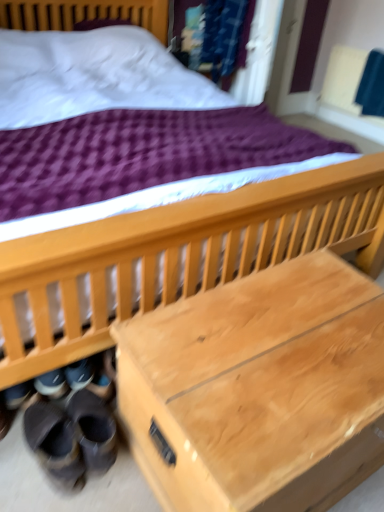
The width and height of the screenshot is (384, 512). Describe the element at coordinates (93, 429) in the screenshot. I see `black suede shoes at lower left, the first footwear from the right` at that location.

In the scene shown: Measure the distance between leather brown shoes at lower left and camera.

They are 3.74 feet apart.

Find the location of `leather-like brown shoes at lower left, which is the first footwear in left-to-right order`. leather-like brown shoes at lower left, which is the first footwear in left-to-right order is located at coordinates (55, 444).

Image resolution: width=384 pixels, height=512 pixels. I want to click on black suede shoes at lower left, the first footwear from the right, so click(x=93, y=429).

Considering the relative positions of leather brown shoes at lower left and black suede shoes at lower left, the first footwear from the right, in the image provided, is leather brown shoes at lower left to the left of black suede shoes at lower left, the first footwear from the right, from the viewer's perspective?

Yes.

Is leather brown shoes at lower left taller than black suede shoes at lower left, arranged as the 2th footwear when viewed from the left?

Indeed, leather brown shoes at lower left has a greater height compared to black suede shoes at lower left, arranged as the 2th footwear when viewed from the left.

Is leather brown shoes at lower left further to the viewer compared to black suede shoes at lower left, the first footwear from the right?

No, the depth of leather brown shoes at lower left is less than that of black suede shoes at lower left, the first footwear from the right.

Which of these two, natural wood trunk at lower center or leather brown shoes at lower left, is thinner?

Thinner between the two is leather brown shoes at lower left.

Does point (146, 382) lie in front of point (71, 444)?

Yes, point (146, 382) is closer to viewer.

From the image's perspective, is natural wood trunk at lower center located above leather brown shoes at lower left?

Correct, natural wood trunk at lower center appears higher than leather brown shoes at lower left in the image.

Considering their positions, is leather brown shoes at lower left located in front of or behind natural wood trunk at lower center?

leather brown shoes at lower left is behind natural wood trunk at lower center.

Considering the sizes of objects leather brown shoes at lower left and natural wood trunk at lower center in the image provided, who is wider, leather brown shoes at lower left or natural wood trunk at lower center?

With larger width is natural wood trunk at lower center.

From a real-world perspective, is leather brown shoes at lower left physically located above or below natural wood trunk at lower center?

Clearly, from a real-world perspective, leather brown shoes at lower left is below natural wood trunk at lower center.

From the image's perspective, which is above, leather brown shoes at lower left or natural wood trunk at lower center?

natural wood trunk at lower center, from the image's perspective.

Which object is wider, black suede shoes at lower left, the first footwear from the right, or natural wood trunk at lower center?

natural wood trunk at lower center is wider.

Between black suede shoes at lower left, the first footwear from the right, and natural wood trunk at lower center, which one has more height?

Standing taller between the two is natural wood trunk at lower center.

Is black suede shoes at lower left, the first footwear from the right, bigger or smaller than natural wood trunk at lower center?

Clearly, black suede shoes at lower left, the first footwear from the right, is smaller in size than natural wood trunk at lower center.

Can you see black suede shoes at lower left, arranged as the 2th footwear when viewed from the left, touching natural wood trunk at lower center?

No, black suede shoes at lower left, arranged as the 2th footwear when viewed from the left, is not in contact with natural wood trunk at lower center.

The width and height of the screenshot is (384, 512). What are the coordinates of `the 1st footwear positioned below the leather brown shoes at lower left (from a real-world perspective)` in the screenshot? It's located at (55, 444).

From the picture: Is leather-like brown shoes at lower left, which is the first footwear in left-to-right order, to the right of leather brown shoes at lower left from the viewer's perspective?

No, leather-like brown shoes at lower left, which is the first footwear in left-to-right order, is not to the right of leather brown shoes at lower left.

Is leather-like brown shoes at lower left, which is the first footwear in left-to-right order, located outside leather brown shoes at lower left?

No, leather-like brown shoes at lower left, which is the first footwear in left-to-right order, is not outside of leather brown shoes at lower left.

Looking at the image, does leather-like brown shoes at lower left, which ranks as the 2th footwear in right-to-left order, seem bigger or smaller compared to leather brown shoes at lower left?

Clearly, leather-like brown shoes at lower left, which ranks as the 2th footwear in right-to-left order, is smaller in size than leather brown shoes at lower left.

Could you tell me if leather-like brown shoes at lower left, which ranks as the 2th footwear in right-to-left order, is turned towards natural wood trunk at lower center?

No, leather-like brown shoes at lower left, which ranks as the 2th footwear in right-to-left order, does not turn towards natural wood trunk at lower center.

Looking at this image, from a real-world perspective, is leather-like brown shoes at lower left, which is the first footwear in left-to-right order, on natural wood trunk at lower center?

No, from a real-world perspective, leather-like brown shoes at lower left, which is the first footwear in left-to-right order, is not over natural wood trunk at lower center

Are leather-like brown shoes at lower left, which is the first footwear in left-to-right order, and natural wood trunk at lower center beside each other?

No, leather-like brown shoes at lower left, which is the first footwear in left-to-right order, is not beside natural wood trunk at lower center.

Is leather-like brown shoes at lower left, which is the first footwear in left-to-right order, not inside natural wood trunk at lower center?

Absolutely, leather-like brown shoes at lower left, which is the first footwear in left-to-right order, is external to natural wood trunk at lower center.

Which of these two, leather brown shoes at lower left or leather-like brown shoes at lower left, which is the first footwear in left-to-right order, is bigger?

With larger size is leather brown shoes at lower left.

Considering the relative positions of leather brown shoes at lower left and leather-like brown shoes at lower left, which ranks as the 2th footwear in right-to-left order, in the image provided, is leather brown shoes at lower left behind leather-like brown shoes at lower left, which ranks as the 2th footwear in right-to-left order,?

That is False.

How much distance is there between leather brown shoes at lower left and leather-like brown shoes at lower left, which ranks as the 2th footwear in right-to-left order?

leather brown shoes at lower left and leather-like brown shoes at lower left, which ranks as the 2th footwear in right-to-left order, are 1.33 inches apart.

Considering the positions of objects leather brown shoes at lower left and leather-like brown shoes at lower left, which ranks as the 2th footwear in right-to-left order, in the image provided, who is more to the left, leather brown shoes at lower left or leather-like brown shoes at lower left, which ranks as the 2th footwear in right-to-left order,?

Positioned to the left is leather-like brown shoes at lower left, which ranks as the 2th footwear in right-to-left order.

The height and width of the screenshot is (512, 384). I want to click on shoe lying in front of the black suede shoes at lower left, arranged as the 2th footwear when viewed from the left, so click(x=74, y=432).

Image resolution: width=384 pixels, height=512 pixels. Identify the location of shoe that appears below the natural wood trunk at lower center (from a real-world perspective). (74, 432).

Based on their spatial positions, is leather brown shoes at lower left or leather-like brown shoes at lower left, which ranks as the 2th footwear in right-to-left order, further from black suede shoes at lower left, the first footwear from the right?

Based on the image, leather-like brown shoes at lower left, which ranks as the 2th footwear in right-to-left order, appears to be further to black suede shoes at lower left, the first footwear from the right.

Looking at the image, which one is located closer to leather brown shoes at lower left, black suede shoes at lower left, the first footwear from the right, or natural wood trunk at lower center?

Among the two, black suede shoes at lower left, the first footwear from the right, is located nearer to leather brown shoes at lower left.

From the image, which object appears to be nearer to black suede shoes at lower left, the first footwear from the right, leather-like brown shoes at lower left, which is the first footwear in left-to-right order, or natural wood trunk at lower center?

Among the two, leather-like brown shoes at lower left, which is the first footwear in left-to-right order, is located nearer to black suede shoes at lower left, the first footwear from the right.

Based on their spatial positions, is black suede shoes at lower left, arranged as the 2th footwear when viewed from the left, or leather brown shoes at lower left closer to leather-like brown shoes at lower left, which ranks as the 2th footwear in right-to-left order?

The object closer to leather-like brown shoes at lower left, which ranks as the 2th footwear in right-to-left order, is leather brown shoes at lower left.

Based on their spatial positions, is leather brown shoes at lower left or black suede shoes at lower left, arranged as the 2th footwear when viewed from the left, closer to leather-like brown shoes at lower left, which ranks as the 2th footwear in right-to-left order?

leather brown shoes at lower left.

From the image, which object appears to be nearer to leather-like brown shoes at lower left, which ranks as the 2th footwear in right-to-left order, black suede shoes at lower left, the first footwear from the right, or natural wood trunk at lower center?

Based on the image, black suede shoes at lower left, the first footwear from the right, appears to be nearer to leather-like brown shoes at lower left, which ranks as the 2th footwear in right-to-left order.

From the image, which object appears to be farther from natural wood trunk at lower center, leather-like brown shoes at lower left, which is the first footwear in left-to-right order, or leather brown shoes at lower left?

Among the two, leather-like brown shoes at lower left, which is the first footwear in left-to-right order, is located further to natural wood trunk at lower center.

From the image, which object appears to be farther from leather brown shoes at lower left, leather-like brown shoes at lower left, which is the first footwear in left-to-right order, or black suede shoes at lower left, the first footwear from the right?

black suede shoes at lower left, the first footwear from the right, is further to leather brown shoes at lower left.

Identify the location of footwear between leather-like brown shoes at lower left, which ranks as the 2th footwear in right-to-left order, and natural wood trunk at lower center, in the horizontal direction. (93, 429).

Identify the location of shoe between leather-like brown shoes at lower left, which ranks as the 2th footwear in right-to-left order, and natural wood trunk at lower center, in the horizontal direction. The image size is (384, 512). click(x=74, y=432).

Identify the location of footwear between leather brown shoes at lower left and black suede shoes at lower left, the first footwear from the right, along the z-axis. 55,444.

Where is `footwear between leather brown shoes at lower left and natural wood trunk at lower center`? footwear between leather brown shoes at lower left and natural wood trunk at lower center is located at coordinates (93, 429).